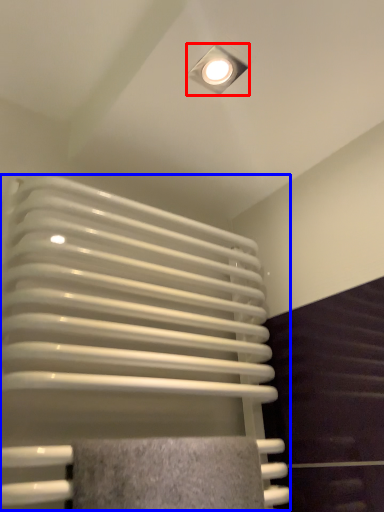
Question: Among these objects, which one is nearest to the camera, lamp (highlighted by a red box) or radiator (highlighted by a blue box)?

Choices:
 (A) lamp
 (B) radiator

Answer: (B)